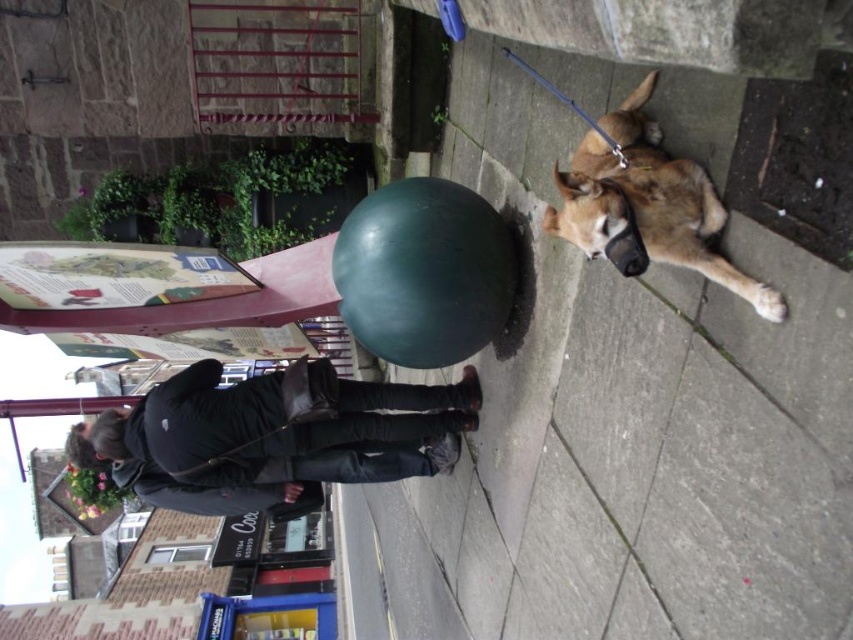
Question: Which object is farther from the camera taking this photo?

Choices:
 (A) brown fur dog at right
 (B) dark gray leather jacket at center

Answer: (B)

Question: Which point appears closest to the camera in this image?

Choices:
 (A) (424, 388)
 (B) (706, 192)

Answer: (B)

Question: From the image, what is the correct spatial relationship of dark gray leather jacket at center in relation to brown fur dog at right?

Choices:
 (A) left
 (B) right

Answer: (A)

Question: Can you confirm if dark gray leather jacket at center is bigger than brown fur dog at right?

Choices:
 (A) yes
 (B) no

Answer: (A)

Question: Can you confirm if dark gray leather jacket at center is bigger than brown fur dog at right?

Choices:
 (A) yes
 (B) no

Answer: (A)